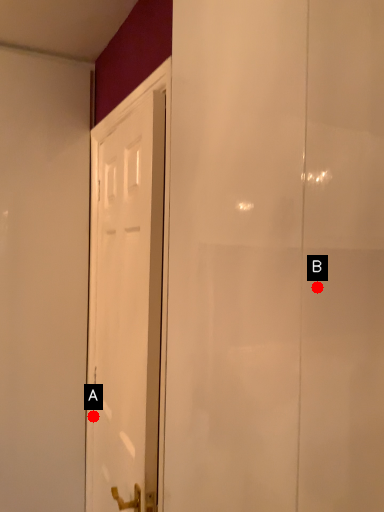
Question: Two points are circled on the image, labeled by A and B beside each circle. Among these points, which one is nearest to the camera?

Choices:
 (A) A is closer
 (B) B is closer

Answer: (B)